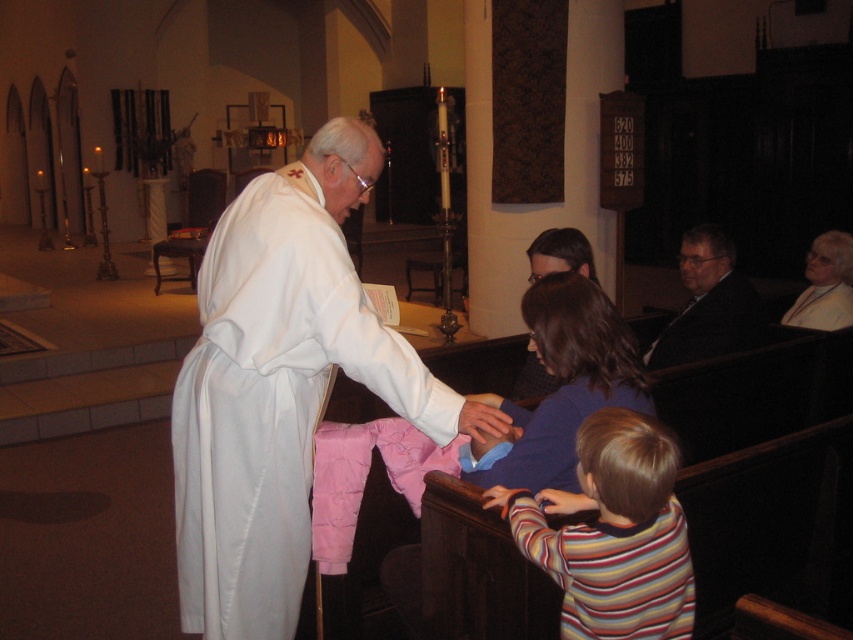
Between white clothed figure at center and matte white robe at center, which one appears on the right side from the viewer's perspective?

From the viewer's perspective, matte white robe at center appears more on the right side.

Can you confirm if white clothed figure at center is wider than matte white robe at center?

Correct, the width of white clothed figure at center exceeds that of matte white robe at center.

Who is more forward, [187,586] or [546,422]?

Point [546,422] is more forward.

This screenshot has width=853, height=640. Find the location of `white clothed figure at center`. white clothed figure at center is located at coordinates (281, 385).

Is matte white robe at center above white matte robe at upper right?

No.

What are the coordinates of `matte white robe at center` in the screenshot? It's located at (438, 461).

Based on the photo, who is higher up, striped cotton shirt at lower right or matte white robe at center?

Positioned higher is matte white robe at center.

Locate an element on the screen. This screenshot has width=853, height=640. striped cotton shirt at lower right is located at coordinates (613, 532).

This screenshot has width=853, height=640. Describe the element at coordinates (613, 532) in the screenshot. I see `striped cotton shirt at lower right` at that location.

What are the coordinates of `striped cotton shirt at lower right` in the screenshot? It's located at (613, 532).